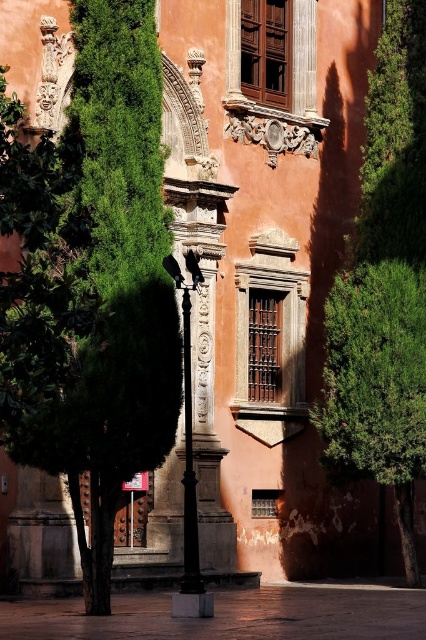
Between point (385, 304) and point (189, 604), which one is positioned in front?

Point (189, 604) is in front.

Can you confirm if green leafy tree at right is positioned below polished metal pole at center?

Yes, green leafy tree at right is below polished metal pole at center.

Where is `green leafy tree at right`? This screenshot has width=426, height=640. green leafy tree at right is located at coordinates (377, 385).

The image size is (426, 640). Identify the location of green leafy tree at right. (377, 385).

Is green leafy tree at right bigger than carved stone column at center?

Yes, green leafy tree at right is bigger than carved stone column at center.

Between green leafy tree at right and carved stone column at center, which one has more height?

carved stone column at center is taller.

Is point (414, 566) in front of point (198, 509)?

No, (414, 566) is further to viewer.

Find the location of `green leafy tree at right`. green leafy tree at right is located at coordinates [x=377, y=385].

Who is shorter, green leafy tree at center or carved stone column at center?

carved stone column at center is shorter.

Can you confirm if green leafy tree at center is positioned to the left of carved stone column at center?

Yes, green leafy tree at center is to the left of carved stone column at center.

This screenshot has height=640, width=426. I want to click on green leafy tree at center, so click(x=114, y=284).